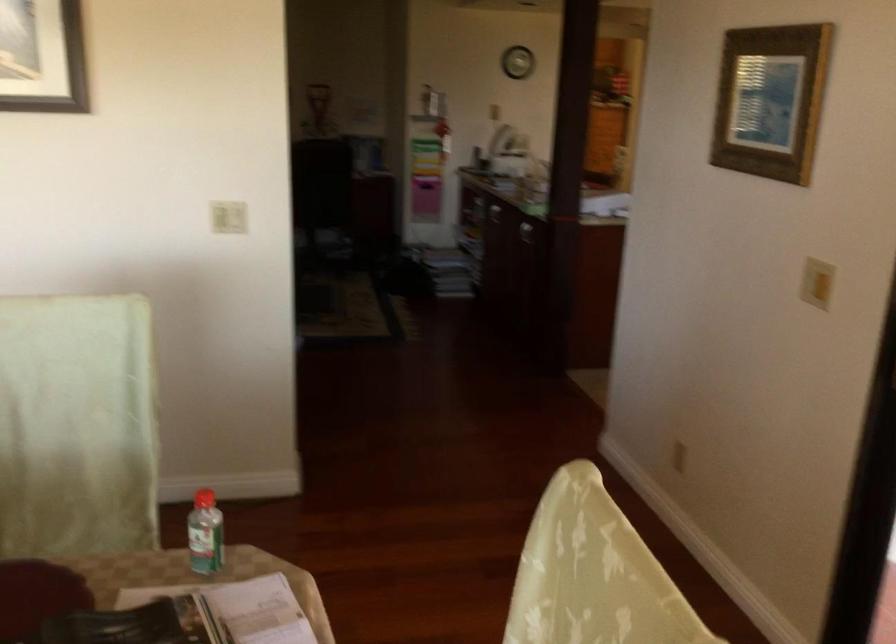
What do you see at coordinates (204, 534) in the screenshot? I see `a small plastic bottle` at bounding box center [204, 534].